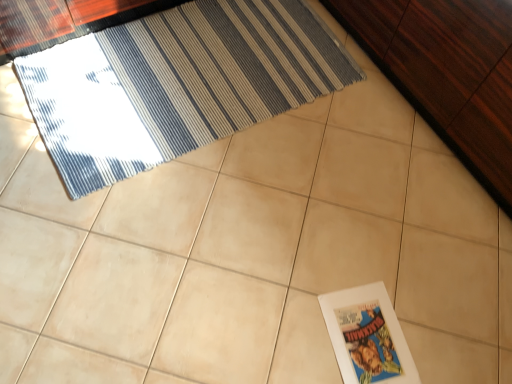
Locate an element on the screen. The height and width of the screenshot is (384, 512). free location to the left of white paper at lower right is located at coordinates (294, 324).